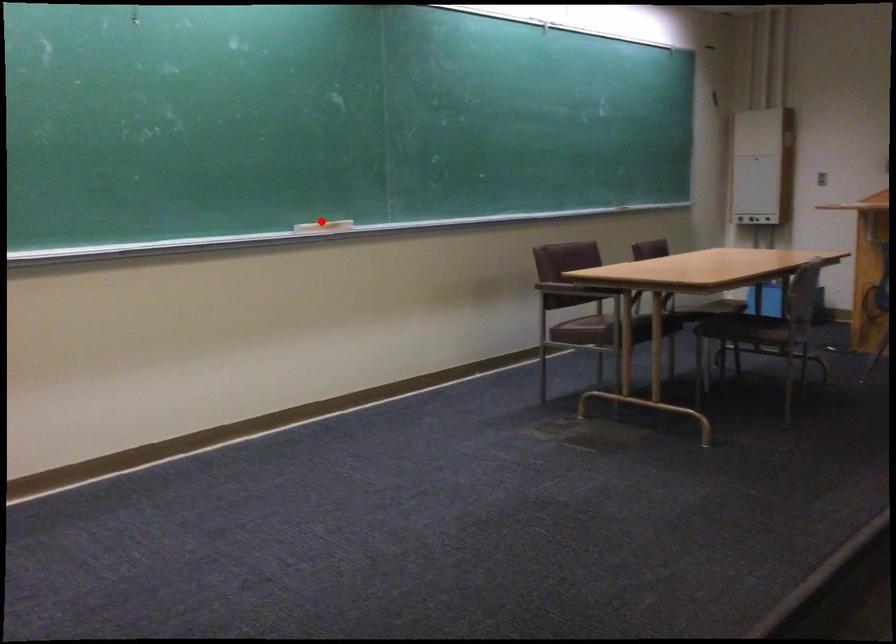
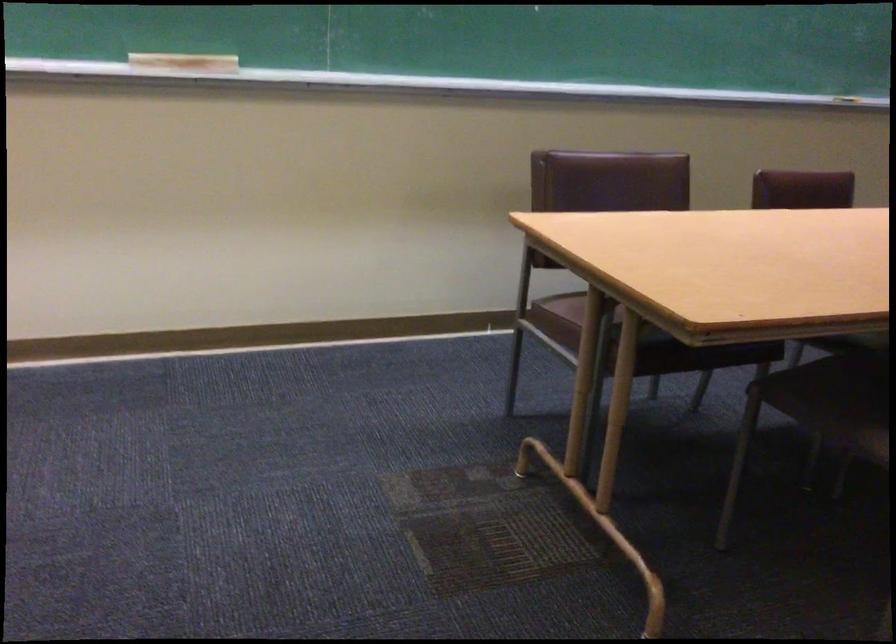
Question: I am providing you with two images of the same scene from different viewpoints. Image1 has a red point marked. In image2, the corresponding 3D location appears at what relative position? Reply with the corresponding letter.

Choices:
 (A) Closer
 (B) Farther

Answer: (A)